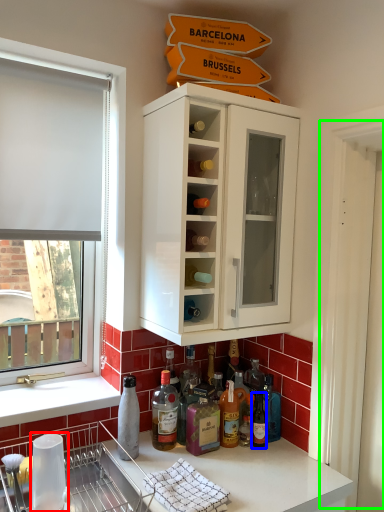
Question: Based on their relative distances, which object is nearer to appliance (highlighted by a red box)? Choose from bottle (highlighted by a blue box) and screen door (highlighted by a green box).

Choices:
 (A) bottle
 (B) screen door

Answer: (A)